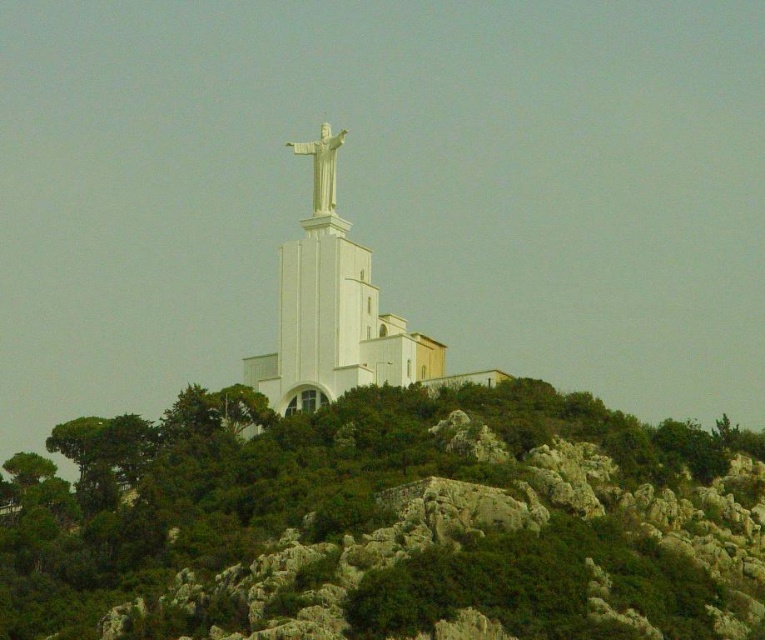
Based on the scene description, where is the white smooth statue at center located in terms of its 2D coordinates?

The white smooth statue at center is located at the 2D coordinates of point (334, 310).

You are a tour guide explaining the layout of the site to visitors. You mention the green leafy hillside at center and the white smooth statue at center. How far apart are these two landmarks?

The green leafy hillside at center and the white smooth statue at center are 16.23 meters apart.

You are a landscape architect planning to add a new pathway between the green leafy hillside at center and the white marble statue at center. Considering their sizes, which area would require more space for the pathway?

The green leafy hillside at center has a larger width than the white marble statue at center, so the pathway would need more space on the side of the green leafy hillside at center.